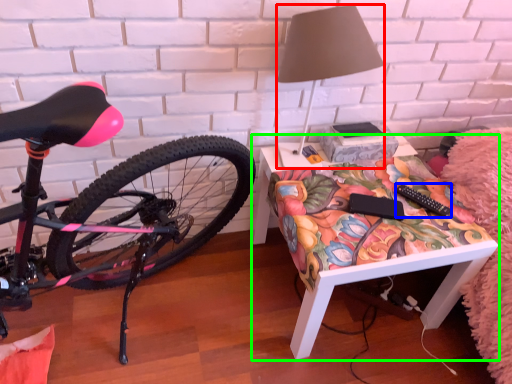
Question: Considering the real-world distances, which object is closest to lamp (highlighted by a red box)? remote control (highlighted by a blue box) or desk (highlighted by a green box).

Choices:
 (A) remote control
 (B) desk

Answer: (A)